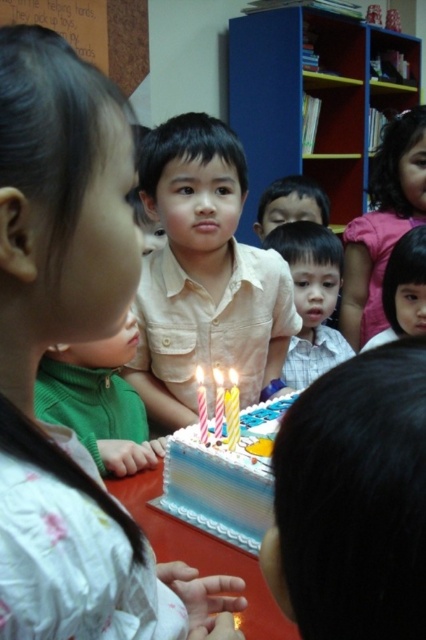
Is point (219, 452) positioned in front of point (216, 401)?

Yes.

Who is positioned more to the left, striped fondant cake at center or yellow striped candle at center?

Positioned to the left is yellow striped candle at center.

The height and width of the screenshot is (640, 426). What do you see at coordinates (226, 477) in the screenshot?
I see `striped fondant cake at center` at bounding box center [226, 477].

At what (x,y) coordinates should I click in order to perform the action: click on striped fondant cake at center. Please return your answer as a coordinate pair (x, y). This screenshot has width=426, height=640. Looking at the image, I should click on (226, 477).

Does light brown shirt at center appear under yellow wax candle at center?

Incorrect, light brown shirt at center is not positioned below yellow wax candle at center.

Image resolution: width=426 pixels, height=640 pixels. Describe the element at coordinates (311, 298) in the screenshot. I see `light brown shirt at center` at that location.

Which is in front, point (333, 260) or point (199, 394)?

Point (199, 394) is more forward.

At what (x,y) coordinates should I click in order to perform the action: click on light brown shirt at center. Please return your answer as a coordinate pair (x, y). Looking at the image, I should click on (311, 298).

Between pink satin dress at upper right and smooth skin face at center, which one appears on the right side from the viewer's perspective?

pink satin dress at upper right

Does pink satin dress at upper right appear under smooth skin face at center?

Yes, pink satin dress at upper right is below smooth skin face at center.

Image resolution: width=426 pixels, height=640 pixels. I want to click on pink satin dress at upper right, so click(382, 224).